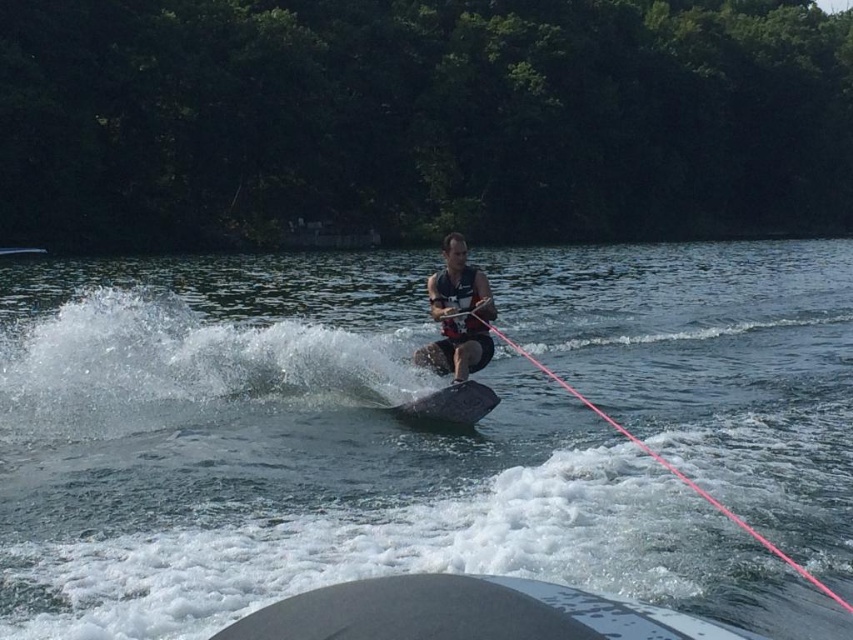
Does clear water at center appear over smooth gray boat at center?

Correct, clear water at center is located above smooth gray boat at center.

Who is more distant from viewer, (x=808, y=627) or (x=427, y=620)?

The point (x=808, y=627) is behind.

The width and height of the screenshot is (853, 640). I want to click on clear water at center, so click(310, 458).

Can you confirm if green leafy trees at upper center is positioned to the left of matte black life vest at center?

Incorrect, green leafy trees at upper center is not on the left side of matte black life vest at center.

Is point (505, 161) closer to camera compared to point (477, 364)?

That is False.

This screenshot has width=853, height=640. Find the location of `green leafy trees at upper center`. green leafy trees at upper center is located at coordinates (421, 120).

Can you confirm if matte black life vest at center is smaller than pink nylon rope at center?

Yes.

Between matte black life vest at center and pink nylon rope at center, which one is positioned higher?

Positioned higher is matte black life vest at center.

The width and height of the screenshot is (853, 640). In order to click on matte black life vest at center in this screenshot , I will do (457, 316).

Where is `matte black life vest at center`? matte black life vest at center is located at coordinates (457, 316).